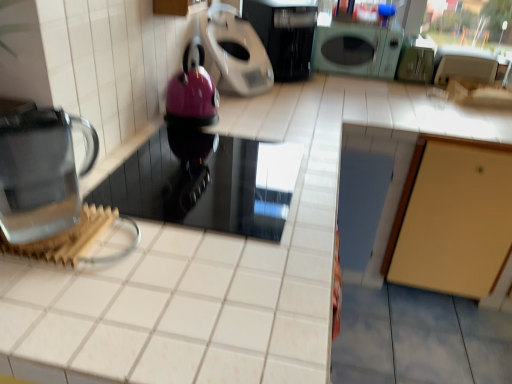
Identify the location of free space above glossy black microwave at center, acting as the second appliance starting from the top (from a real-world perspective). (201, 172).